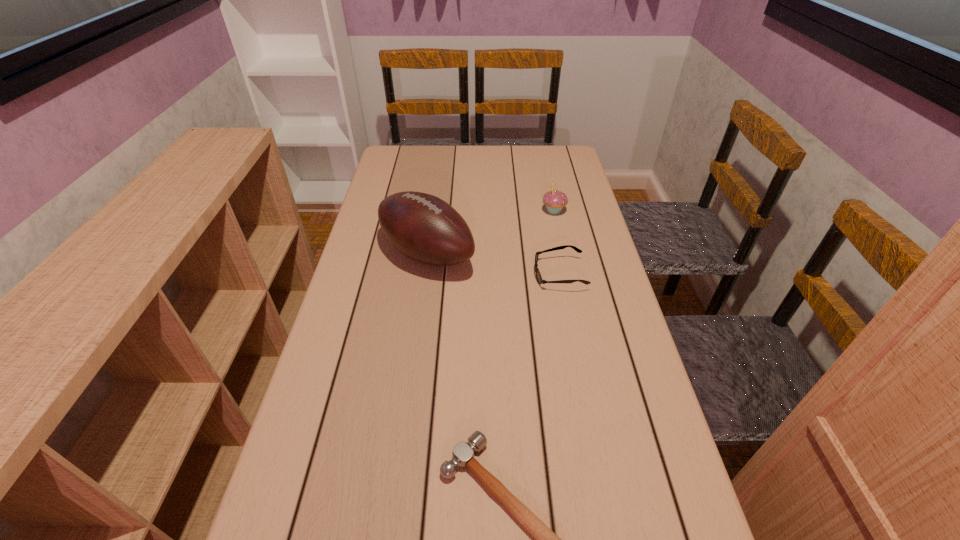
This screenshot has height=540, width=960. I want to click on football (American), so click(x=423, y=227).

Image resolution: width=960 pixels, height=540 pixels. I want to click on cupcake, so click(x=554, y=200).

The width and height of the screenshot is (960, 540). What are the coordinates of `the second tallest object` in the screenshot? It's located at (554, 200).

Locate an element on the screen. the third tallest object is located at coordinates (538, 276).

At what (x,y) coordinates should I click in order to perform the action: click on vacant space situated 0.200m on the back of the tallest object. Please return your answer as a coordinate pair (x, y). This screenshot has width=960, height=540. Looking at the image, I should click on (435, 193).

Where is `free location located 0.380m on the back of the third shortest object`? This screenshot has width=960, height=540. free location located 0.380m on the back of the third shortest object is located at coordinates pyautogui.click(x=541, y=151).

Where is `vacant space located 0.360m on the lenses of the second shortest object`? This screenshot has width=960, height=540. vacant space located 0.360m on the lenses of the second shortest object is located at coordinates [404, 274].

Identify the location of free spot located 0.070m on the lenses of the second shortest object. (509, 274).

Where is `vacant space situated 0.050m on the lenses of the second shortest object`? Image resolution: width=960 pixels, height=540 pixels. vacant space situated 0.050m on the lenses of the second shortest object is located at coordinates (516, 274).

At what (x,y) coordinates should I click in order to perform the action: click on object located at the left edge. Please return your answer as a coordinate pair (x, y). The height and width of the screenshot is (540, 960). Looking at the image, I should click on (423, 227).